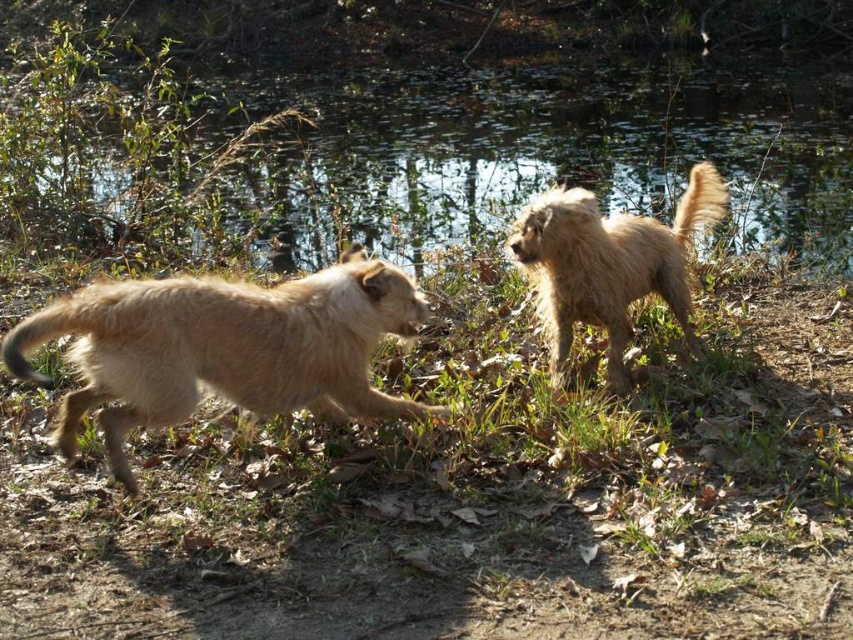
Is fuzzy beige dog at left taller than fuzzy brown dog at center?

Incorrect, fuzzy beige dog at left's height is not larger of fuzzy brown dog at center's.

Does point (318, 285) lie behind point (677, 216)?

No, it is not.

Where is `fuzzy beige dog at left`? The height and width of the screenshot is (640, 853). fuzzy beige dog at left is located at coordinates (223, 348).

Can you confirm if green grass at center is bigger than green grass at upper center?

No.

Can you confirm if green grass at center is shorter than green grass at upper center?

Correct, green grass at center is not as tall as green grass at upper center.

This screenshot has width=853, height=640. I want to click on green grass at center, so click(x=469, y=490).

I want to click on green grass at center, so click(469, 490).

Between green grass at upper center and fuzzy beige dog at left, which one is positioned lower?

fuzzy beige dog at left is below.

Who is taller, green grass at upper center or fuzzy beige dog at left?

green grass at upper center is taller.

This screenshot has width=853, height=640. I want to click on green grass at upper center, so click(x=526, y=154).